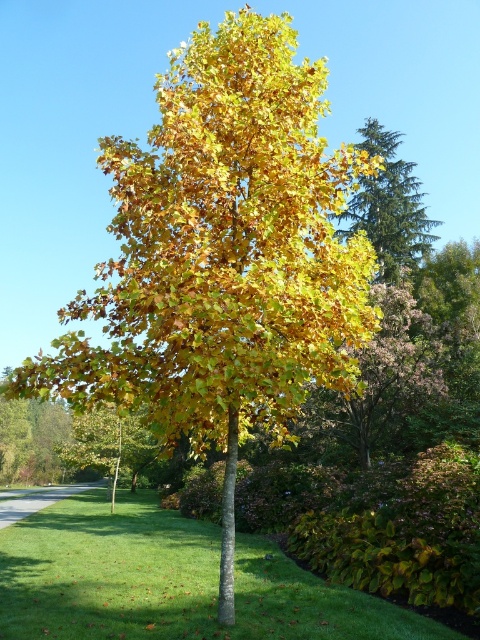
Which is in front, point (248, 637) or point (372, 150)?

Point (248, 637)

Which is behind, point (169, 540) or point (427, 248)?

Positioned behind is point (427, 248).

The image size is (480, 640). Describe the element at coordinates (170, 580) in the screenshot. I see `green grass at center` at that location.

At what (x,y) coordinates should I click in order to perform the action: click on green grass at center. Please return your answer as a coordinate pair (x, y). Looking at the image, I should click on (170, 580).

Can you confirm if green grass at center is smaller than golden yellow leaves at center?

No.

This screenshot has width=480, height=640. I want to click on green grass at center, so click(x=170, y=580).

What do you see at coordinates (170, 580) in the screenshot? I see `green grass at center` at bounding box center [170, 580].

Where is `green grass at center`? The image size is (480, 640). green grass at center is located at coordinates (170, 580).

Is golden yellow leaves at center further to the viewer compared to golden yellow leaves at upper right?

No, it is not.

Can you confirm if golden yellow leaves at center is shorter than golden yellow leaves at upper right?

Yes, golden yellow leaves at center is shorter than golden yellow leaves at upper right.

The width and height of the screenshot is (480, 640). I want to click on golden yellow leaves at center, so click(x=376, y=385).